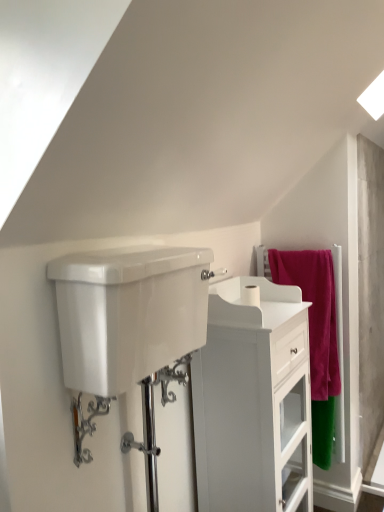
Question: Is pink fabric towel at right next to concrete screen door at right?

Choices:
 (A) no
 (B) yes

Answer: (A)

Question: From a real-world perspective, is pink fabric towel at right physically below concrete screen door at right?

Choices:
 (A) yes
 (B) no

Answer: (A)

Question: Is pink fabric towel at right positioned with its back to concrete screen door at right?

Choices:
 (A) no
 (B) yes

Answer: (B)

Question: Is pink fabric towel at right to the right of concrete screen door at right from the viewer's perspective?

Choices:
 (A) no
 (B) yes

Answer: (A)

Question: Is pink fabric towel at right at the left side of concrete screen door at right?

Choices:
 (A) yes
 (B) no

Answer: (A)

Question: Considering the positions of concrete screen door at right and white glossy tank at center in the image, is concrete screen door at right wider or thinner than white glossy tank at center?

Choices:
 (A) wide
 (B) thin

Answer: (B)

Question: Is point (375, 144) positioned closer to the camera than point (150, 315)?

Choices:
 (A) farther
 (B) closer

Answer: (A)

Question: Considering the positions of concrete screen door at right and white glossy tank at center in the image, is concrete screen door at right taller or shorter than white glossy tank at center?

Choices:
 (A) tall
 (B) short

Answer: (A)

Question: Is concrete screen door at right in front of or behind white glossy tank at center in the image?

Choices:
 (A) front
 (B) behind

Answer: (B)

Question: Is polished chrome shower door at center in front of or behind chrome metallic faucet at lower left in the image?

Choices:
 (A) behind
 (B) front

Answer: (A)

Question: Considering the positions of polished chrome shower door at center and chrome metallic faucet at lower left in the image, is polished chrome shower door at center wider or thinner than chrome metallic faucet at lower left?

Choices:
 (A) thin
 (B) wide

Answer: (B)

Question: Considering the positions of polished chrome shower door at center and chrome metallic faucet at lower left in the image, is polished chrome shower door at center bigger or smaller than chrome metallic faucet at lower left?

Choices:
 (A) big
 (B) small

Answer: (A)

Question: Would you say polished chrome shower door at center is to the left or to the right of chrome metallic faucet at lower left in the picture?

Choices:
 (A) right
 (B) left

Answer: (A)

Question: In terms of width, does chrome metallic faucet at lower left look wider or thinner when compared to polished chrome shower door at center?

Choices:
 (A) thin
 (B) wide

Answer: (A)

Question: From a real-world perspective, is chrome metallic faucet at lower left physically located above or below polished chrome shower door at center?

Choices:
 (A) above
 (B) below

Answer: (A)